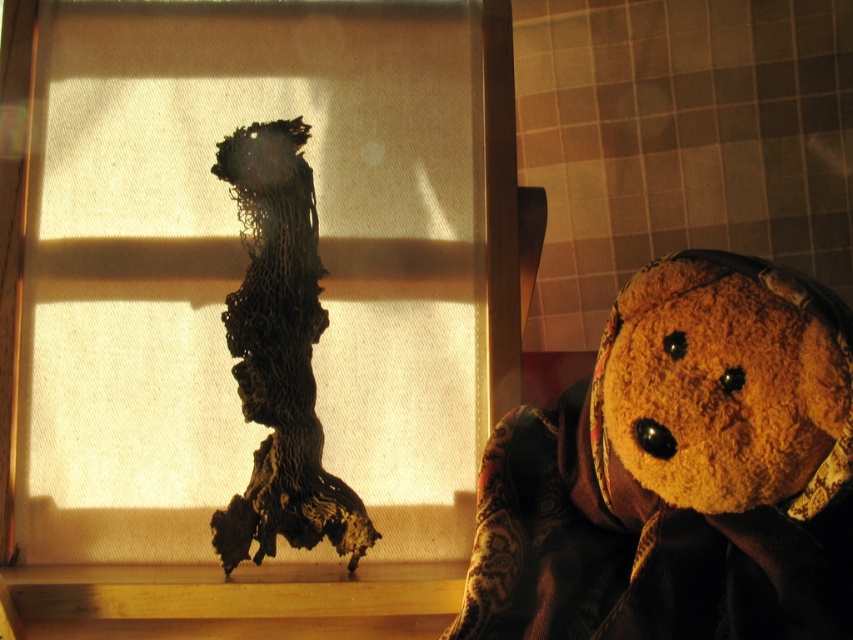
Which is more to the left, translucent fabric at center or charcoal textured fabric at center?

translucent fabric at center

Does translucent fabric at center lie behind charcoal textured fabric at center?

Yes, translucent fabric at center is further from the viewer.

Does point (111, 440) come farther from viewer compared to point (236, 520)?

Yes, it is behind point (236, 520).

Find the location of a particular element. The image size is (853, 640). translucent fabric at center is located at coordinates (251, 280).

Between fuzzy brown teddy bear at right and charcoal textured fabric at center, which one has less height?

Standing shorter between the two is fuzzy brown teddy bear at right.

Does point (804, 388) come behind point (248, 330)?

No, it is in front of (248, 330).

Locate an element on the screen. fuzzy brown teddy bear at right is located at coordinates (679, 472).

Which is more to the right, translucent fabric at center or fuzzy brown teddy bear at right?

From the viewer's perspective, fuzzy brown teddy bear at right appears more on the right side.

Identify the location of translucent fabric at center. The image size is (853, 640). (251, 280).